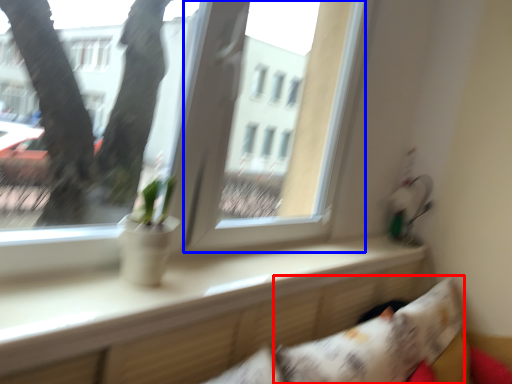
Question: Which of the following is the closest to the observer, pillow (highlighted by a red box) or window screen (highlighted by a blue box)?

Choices:
 (A) pillow
 (B) window screen

Answer: (A)